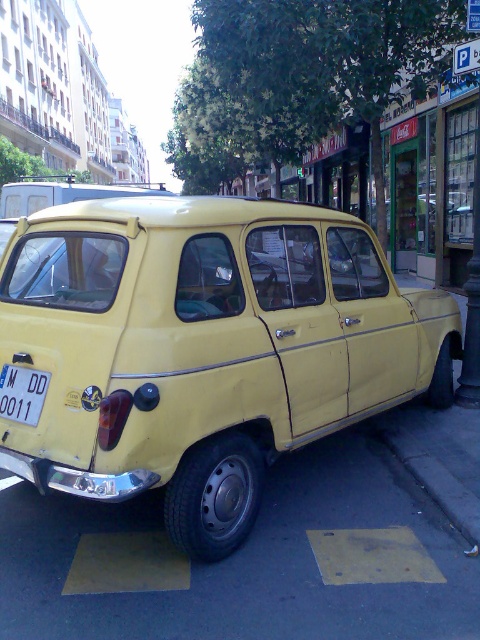
Question: Can you confirm if yellow matte car at center is thinner than white plastic license plate at center?

Choices:
 (A) yes
 (B) no

Answer: (B)

Question: Does yellow matte car at center lie in front of white plastic license plate at center?

Choices:
 (A) yes
 (B) no

Answer: (A)

Question: In this image, where is yellow matte car at center located relative to white plastic license plate at center?

Choices:
 (A) above
 (B) below

Answer: (A)

Question: Among these objects, which one is nearest to the camera?

Choices:
 (A) yellow matte car at center
 (B) white plastic license plate at center

Answer: (A)

Question: Among these points, which one is farthest from the camera?

Choices:
 (A) (140, 253)
 (B) (32, 403)

Answer: (B)

Question: Which of the following is the farthest from the observer?

Choices:
 (A) white plastic license plate at center
 (B) yellow matte car at center

Answer: (A)